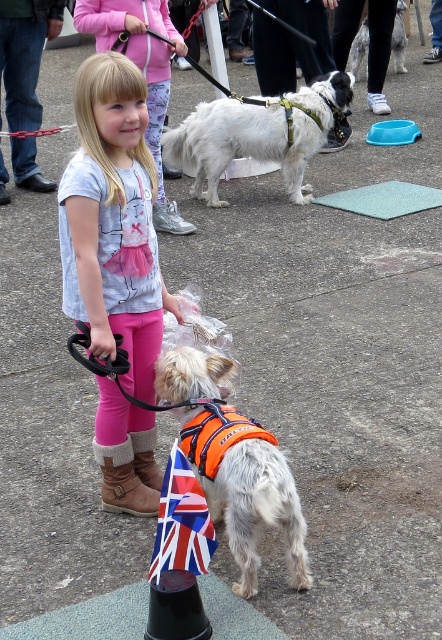
You are a photographer trying to capture a photo of the union jack fabric flag at lower center and the brown suede boot at lower left. From your current position, can you see both objects in the frame without moving your camera?

The union jack fabric flag at lower center is above the brown suede boot at lower left, so yes, both objects are visible in the frame as they are positioned vertically one above the other.

You are standing at point [156,538] and want to walk to point [190,128]. Which direction should you face to move towards your destination?

To move from point [156,538] to point [190,128], you should face towards the left since point [190,128] is behind point [156,538].